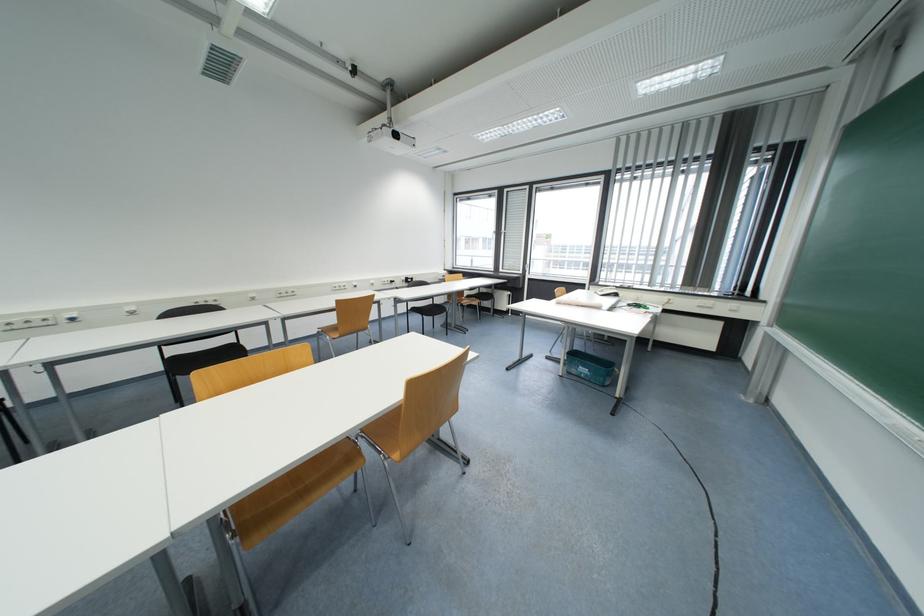
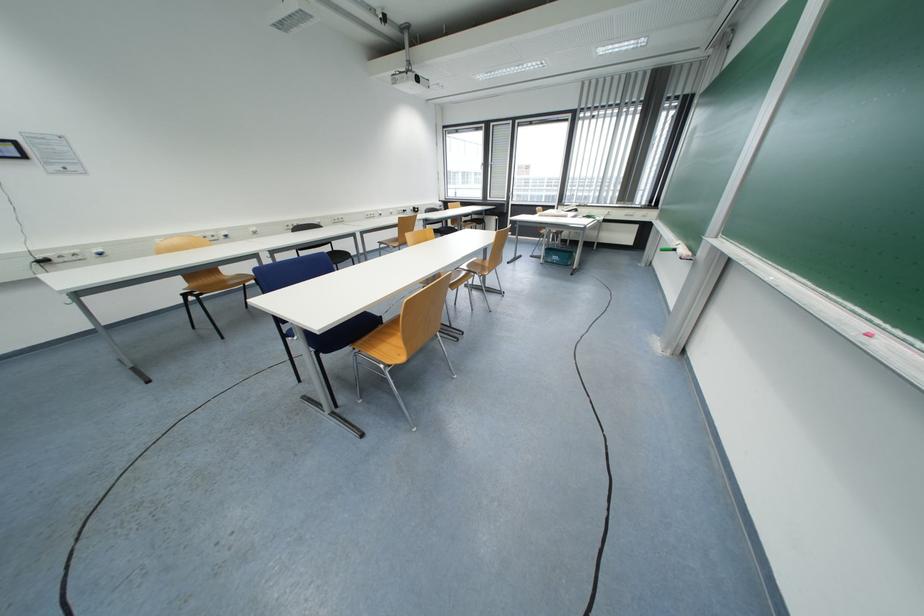
In the second image, find the point that corresponds to [589,371] in the first image.

(561, 260)